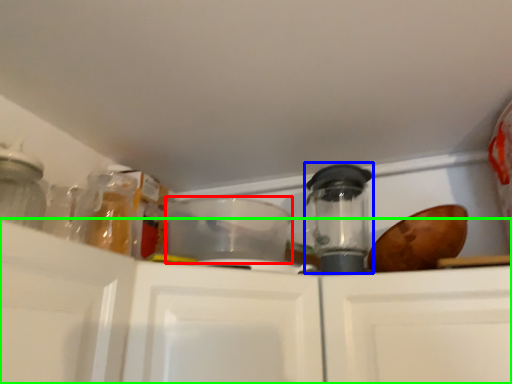
Question: Which object is the closest to the appliance (highlighted by a red box)? Choose among these: appliance (highlighted by a blue box) or cabinetry (highlighted by a green box).

Choices:
 (A) appliance
 (B) cabinetry

Answer: (A)